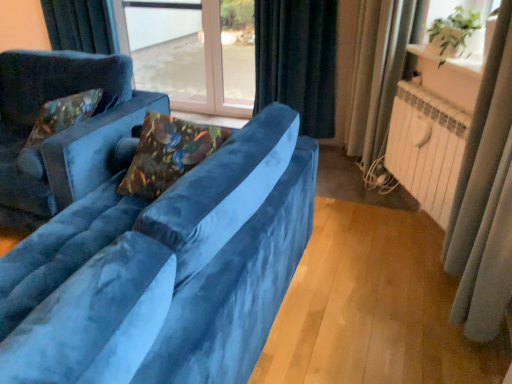
What do you see at coordinates (378, 72) in the screenshot?
I see `beige fabric curtain at right, acting as the 2th curtain starting from the back` at bounding box center [378, 72].

You are a GUI agent. You are given a task and a screenshot of the screen. Output one action in this format:
    pyautogui.click(x=<x>, y=<y>)
    Task: Click on the transparent glass window at center
    
    Given the screenshot: What is the action you would take?
    pyautogui.click(x=192, y=52)

The width and height of the screenshot is (512, 384). Describe the element at coordinates (192, 52) in the screenshot. I see `transparent glass window at center` at that location.

What do you see at coordinates (297, 60) in the screenshot? This screenshot has width=512, height=384. I see `black velvet curtain at upper center, the third curtain viewed from the front` at bounding box center [297, 60].

The width and height of the screenshot is (512, 384). Identify the location of velvet floral pillow at left, marked as the 1th pillow in a back-to-front arrangement. (55, 126).

Find the location of a particular element. transparent glass window screen at center, placed as the 2th window screen when sorted from right to left is located at coordinates (238, 51).

Looking at this image, can you confirm if velvet floral pillow at left, arranged as the 2th pillow when viewed from the front, is thinner than velvet floral pillow at center, placed as the first pillow when sorted from front to back?

Correct, the width of velvet floral pillow at left, arranged as the 2th pillow when viewed from the front, is less than that of velvet floral pillow at center, placed as the first pillow when sorted from front to back.

Does point (30, 140) come in front of point (145, 172)?

No, (30, 140) is further to viewer.

Is velvet floral pillow at left, the first pillow in the left-to-right sequence, spatially inside velvet floral pillow at center, the 2th pillow in the back-to-front sequence, or outside of it?

The correct answer is: outside.

Is there a large distance between transparent glass window at center and black velvet curtain at upper center, arranged as the 1th curtain when viewed from the back?

Yes.

Considering the sizes of objects transparent glass window at center and black velvet curtain at upper center, the third curtain viewed from the front, in the image provided, who is bigger, transparent glass window at center or black velvet curtain at upper center, the third curtain viewed from the front,?

black velvet curtain at upper center, the third curtain viewed from the front, is bigger.

From the image's perspective, which object appears higher, transparent glass window at center or black velvet curtain at upper center, the third curtain viewed from the front?

transparent glass window at center is shown above in the image.

Is velvet blue couch at left, arranged as the 2th studio couch when viewed from the left, placed right next to beige fabric curtain at right, which ranks as the second curtain in front-to-back order?

They are not placed beside each other.

Considering the relative positions of velvet blue couch at left, arranged as the 2th studio couch when viewed from the left, and beige fabric curtain at right, which ranks as the second curtain in front-to-back order, in the image provided, is velvet blue couch at left, arranged as the 2th studio couch when viewed from the left, to the right of beige fabric curtain at right, which ranks as the second curtain in front-to-back order, from the viewer's perspective?

Incorrect, velvet blue couch at left, arranged as the 2th studio couch when viewed from the left, is not on the right side of beige fabric curtain at right, which ranks as the second curtain in front-to-back order.

Starting from the beige fabric curtain at right, acting as the 2th curtain starting from the back, which studio couch is the 2nd one in front? Please provide its 2D coordinates.

[(166, 266)]

Is velvet blue couch at left, arranged as the 1th studio couch when viewed from the right, facing away from beige fabric curtain at right, acting as the 2th curtain starting from the back?

That's not correct — velvet blue couch at left, arranged as the 1th studio couch when viewed from the right, is not looking away from beige fabric curtain at right, acting as the 2th curtain starting from the back.

This screenshot has width=512, height=384. I want to click on pillow behind the white painted metal radiator at right, so click(55, 126).

Based on their sizes in the image, would you say velvet floral pillow at left, the second pillow when ordered from right to left, is bigger or smaller than white painted metal radiator at right?

Considering their sizes, velvet floral pillow at left, the second pillow when ordered from right to left, takes up less space than white painted metal radiator at right.

Is velvet floral pillow at left, the first pillow in the left-to-right sequence, inside or outside of white painted metal radiator at right?

velvet floral pillow at left, the first pillow in the left-to-right sequence, cannot be found inside white painted metal radiator at right.

Is velvet floral pillow at left, marked as the 1th pillow in a back-to-front arrangement, to the left or to the right of white painted metal radiator at right in the image?

In the image, velvet floral pillow at left, marked as the 1th pillow in a back-to-front arrangement, appears on the left side of white painted metal radiator at right.

Is white glossy window sill at upper right oriented towards velvet blue couch at left, arranged as the 2th studio couch when viewed from the left?

A: No.

What's the angular difference between white glossy window sill at upper right and velvet blue couch at left, arranged as the 2th studio couch when viewed from the left,'s facing directions?

26.9 degrees.

In the scene shown: Is white glossy window sill at upper right situated inside velvet blue couch at left, arranged as the 2th studio couch when viewed from the left, or outside?

white glossy window sill at upper right is outside velvet blue couch at left, arranged as the 2th studio couch when viewed from the left.

What are the coordinates of `the 2nd studio couch below when counting from the white glossy window sill at upper right (from the image's perspective)` in the screenshot? It's located at (166, 266).

Is white glossy window sill at upper right inside white painted metal radiator at right?

No, white painted metal radiator at right does not contain white glossy window sill at upper right.

Is white painted metal radiator at right facing away from white glossy window sill at upper right?

That's not correct — white painted metal radiator at right is not looking away from white glossy window sill at upper right.

How many degrees apart are the facing directions of white painted metal radiator at right and white glossy window sill at upper right?

white painted metal radiator at right and white glossy window sill at upper right are facing 0.877 degrees away from each other.

How much distance is there between velvet floral pillow at center, which is the first pillow in right-to-left order, and black velvet curtain at upper center, the third curtain viewed from the front?

A distance of 5.77 feet exists between velvet floral pillow at center, which is the first pillow in right-to-left order, and black velvet curtain at upper center, the third curtain viewed from the front.

Is velvet floral pillow at center, which is the first pillow in right-to-left order, turned away from black velvet curtain at upper center, the third curtain viewed from the front?

Yes.

Is velvet floral pillow at center, placed as the first pillow when sorted from front to back, far away from black velvet curtain at upper center, the third curtain viewed from the front?

Yes, velvet floral pillow at center, placed as the first pillow when sorted from front to back, is far from black velvet curtain at upper center, the third curtain viewed from the front.

Where is `pillow on the right of velvet floral pillow at left, the first pillow in the left-to-right sequence`? This screenshot has height=384, width=512. pillow on the right of velvet floral pillow at left, the first pillow in the left-to-right sequence is located at coordinates (168, 153).

Identify the location of window that is above the black velvet curtain at upper center, the third curtain viewed from the front (from the image's perspective). This screenshot has height=384, width=512. coord(192,52).

Looking at the image, which one is located closer to white glossy window sill at upper right, beige fabric curtain at right, acting as the 2th curtain starting from the back, or velvet blue couch at left, the second studio couch positioned from the right?

Among the two, beige fabric curtain at right, acting as the 2th curtain starting from the back, is located nearer to white glossy window sill at upper right.

From the image, which object appears to be farther from velvet floral pillow at left, arranged as the 2th pillow when viewed from the front, velvet floral pillow at center, the 2th pillow in the back-to-front sequence, or transparent glass window at center?

transparent glass window at center lies further to velvet floral pillow at left, arranged as the 2th pillow when viewed from the front, than the other object.

Based on their spatial positions, is velvet floral pillow at center, the 2th pillow in the back-to-front sequence, or white glossy window sill at upper right further from silky gray curtain at right, the third curtain viewed from the back?

velvet floral pillow at center, the 2th pillow in the back-to-front sequence, is positioned further to the anchor silky gray curtain at right, the third curtain viewed from the back.

Considering their positions, is velvet floral pillow at left, the first pillow in the left-to-right sequence, positioned closer to white glossy window sill at upper right than silky gray curtain at right, the third curtain viewed from the back?

silky gray curtain at right, the third curtain viewed from the back.

Which object lies nearer to the anchor point white glossy window sill at upper right, transparent glass window at center or velvet floral pillow at left, marked as the 1th pillow in a back-to-front arrangement?

velvet floral pillow at left, marked as the 1th pillow in a back-to-front arrangement, is closer to white glossy window sill at upper right.

Based on their spatial positions, is velvet blue couch at left, arranged as the 1th studio couch when viewed from the right, or transparent glass window screen at center, placed as the 2th window screen when sorted from right to left, closer to beige fabric curtain at right, acting as the 2th curtain starting from the back?

Among the two, transparent glass window screen at center, placed as the 2th window screen when sorted from right to left, is located nearer to beige fabric curtain at right, acting as the 2th curtain starting from the back.

Looking at the image, which one is located further to transparent glass window screen at center, placed as the 2th window screen when sorted from right to left, velvet floral pillow at left, arranged as the 2th pillow when viewed from the front, or velvet blue couch at left, arranged as the 1th studio couch when viewed from the right?

Among the two, velvet blue couch at left, arranged as the 1th studio couch when viewed from the right, is located further to transparent glass window screen at center, placed as the 2th window screen when sorted from right to left.

In the scene shown: Looking at the image, which one is located closer to beige fabric curtain at right, which ranks as the second curtain in front-to-back order, white painted metal radiator at right or black velvet curtain at upper center, the third curtain viewed from the front?

white painted metal radiator at right is closer to beige fabric curtain at right, which ranks as the second curtain in front-to-back order.

In order to click on window sill located between velvet blue couch at left, arranged as the 1th studio couch when viewed from the right, and black velvet curtain at upper center, the third curtain viewed from the front, in the depth direction in this screenshot , I will do `click(465, 67)`.

At what (x,y) coordinates should I click in order to perform the action: click on window screen between velvet blue couch at left, arranged as the 2th studio couch when viewed from the left, and black velvet curtain at upper center, the third curtain viewed from the front, along the z-axis. Please return your answer as a coordinate pair (x, y). Looking at the image, I should click on (456, 27).

I want to click on studio couch situated between velvet blue couch at left, arranged as the 1th studio couch when viewed from the left, and white painted metal radiator at right from left to right, so click(x=166, y=266).

Where is `radiator between velvet blue couch at left, arranged as the 2th studio couch when viewed from the left, and white glossy window sill at upper right from left to right`? radiator between velvet blue couch at left, arranged as the 2th studio couch when viewed from the left, and white glossy window sill at upper right from left to right is located at coordinates (426, 147).